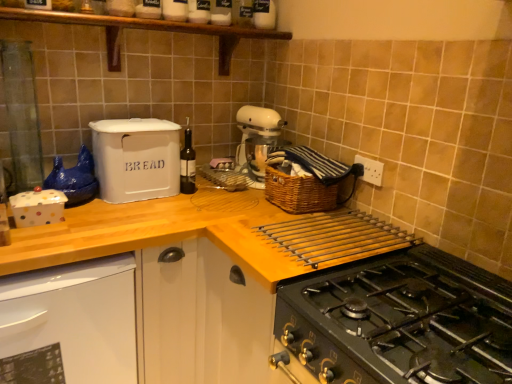
You are a GUI agent. You are given a task and a screenshot of the screen. Output one action in this format:
    pyautogui.click(x=<x>, y=<y>)
    Task: Click on the blank space situated above white matte bread bin at upper left (from a real-world perspective)
    This screenshot has height=384, width=512.
    Given the screenshot: What is the action you would take?
    pyautogui.click(x=126, y=121)